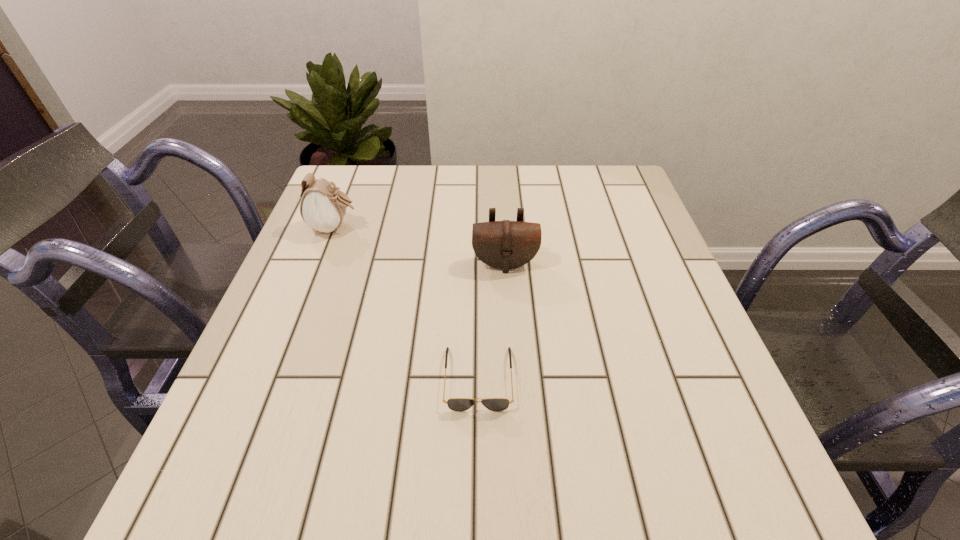
Find the location of `free location at the near edge`. free location at the near edge is located at coordinates (300, 498).

In order to click on free spot at the left edge of the desktop in this screenshot , I will do pyautogui.click(x=342, y=320).

This screenshot has height=540, width=960. Find the location of `vacant space at the right edge of the desktop`. vacant space at the right edge of the desktop is located at coordinates (623, 224).

I want to click on blank space at the far left corner of the desktop, so click(364, 189).

Find the location of `vacant space at the near left corner`. vacant space at the near left corner is located at coordinates (252, 501).

The height and width of the screenshot is (540, 960). I want to click on vacant region at the far right corner of the desktop, so click(x=636, y=192).

This screenshot has height=540, width=960. In order to click on vacant area between the left pouch and the sunglasses in this screenshot , I will do `click(406, 303)`.

The width and height of the screenshot is (960, 540). What are the coordinates of `free area in between the nearer pouch and the shortest object` in the screenshot? It's located at (492, 321).

Where is `unoccupied position between the sunglasses and the second nearest object`? unoccupied position between the sunglasses and the second nearest object is located at coordinates (492, 321).

Locate an element on the screen. This screenshot has width=960, height=540. free space between the nearest object and the farther pouch is located at coordinates (406, 303).